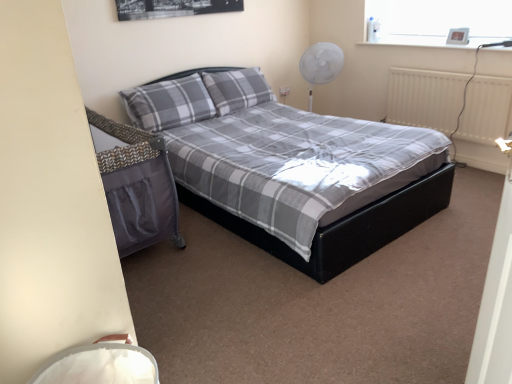
This screenshot has width=512, height=384. Find the location of `vacant space behind metallic digital clock at upper right`. vacant space behind metallic digital clock at upper right is located at coordinates (448, 44).